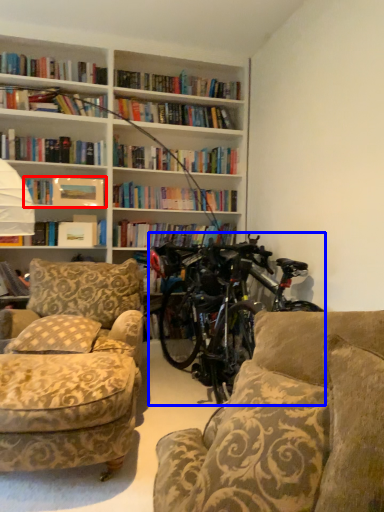
Question: Which object appears closest to the camera in this image, book (highlighted by a red box) or bicycle (highlighted by a blue box)?

Choices:
 (A) book
 (B) bicycle

Answer: (B)